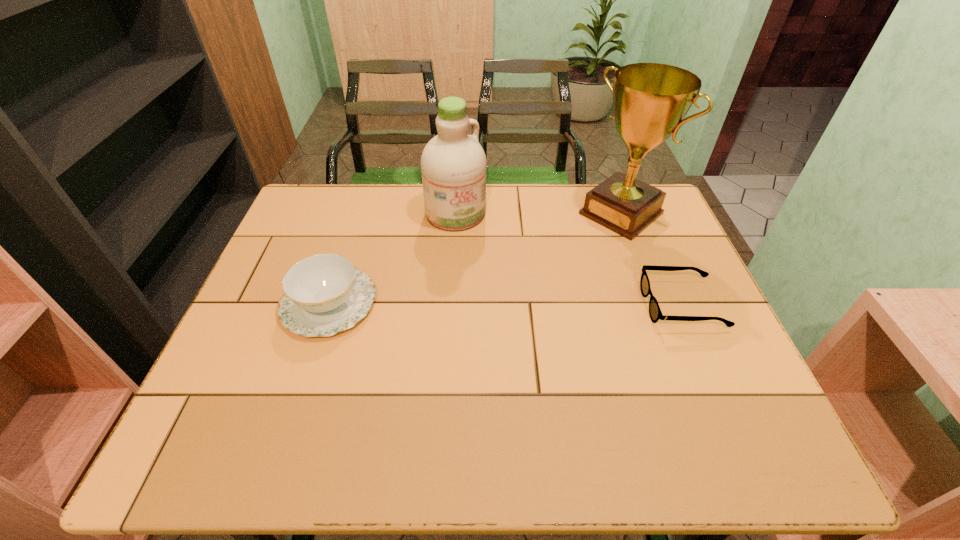
Where is `free spot between the third object from right to left and the shortest object`? The image size is (960, 540). free spot between the third object from right to left and the shortest object is located at coordinates (568, 259).

I want to click on empty space that is in between the award and the spectacles, so click(x=651, y=260).

Find the location of a particular element. vacant area that lies between the award and the cleansing agent is located at coordinates (539, 213).

You are a GUI agent. You are given a task and a screenshot of the screen. Output one action in this format:
    pyautogui.click(x=<x>, y=<y>)
    Task: Click on the blank region between the award and the second object from left to right
    The width and height of the screenshot is (960, 540).
    Given the screenshot: What is the action you would take?
    pyautogui.click(x=539, y=213)

Locate an element on the screen. The width and height of the screenshot is (960, 540). free space between the third object from right to left and the chinaware is located at coordinates (393, 259).

Locate which object ranks in proximity to the chinaware. Please provide its 2D coordinates. Your answer should be formatted as a tuple, i.e. [(x, y)], where the tuple contains the x and y coordinates of a point satisfying the conditions above.

[(453, 164)]

Point out which object is positioned as the second nearest to the award. Please provide its 2D coordinates. Your answer should be formatted as a tuple, i.e. [(x, y)], where the tuple contains the x and y coordinates of a point satisfying the conditions above.

[(453, 164)]

In order to click on vacant area in the image that satisfies the following two spatial constraints: 1. on the front side of the shortest object; 2. on the arms of the cleansing agent in this screenshot , I will do `click(449, 306)`.